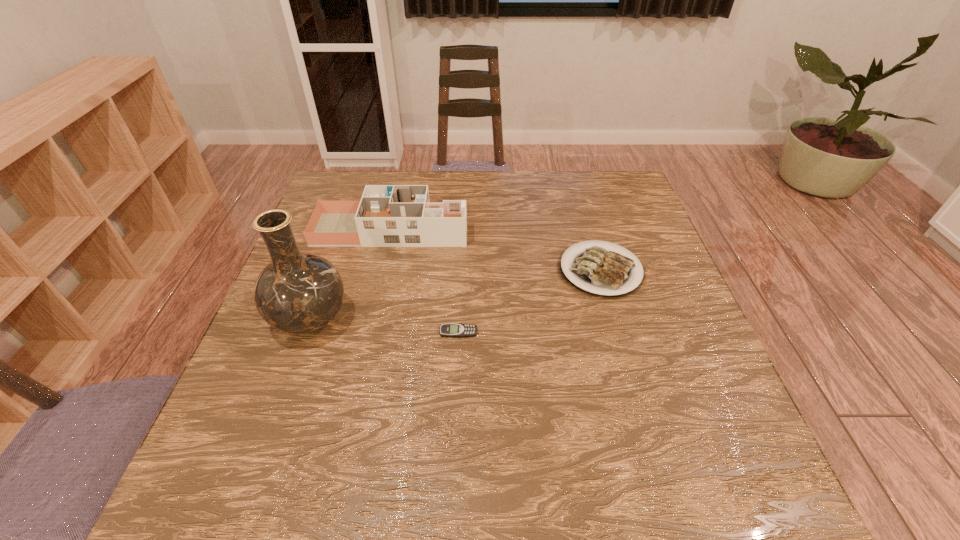
Point out which object is positioned as the third nearest to the tallest object. Please provide its 2D coordinates. Your answer should be formatted as a tuple, i.e. [(x, y)], where the tuple contains the x and y coordinates of a point satisfying the conditions above.

[(601, 271)]

You are a GUI agent. You are given a task and a screenshot of the screen. Output one action in this format:
    pyautogui.click(x=<x>, y=<y>)
    Task: Click on the object that is the closest to the dollhouse
    The width and height of the screenshot is (960, 540).
    Given the screenshot: What is the action you would take?
    pyautogui.click(x=297, y=293)

You are a GUI agent. You are given a task and a screenshot of the screen. Output one action in this format:
    pyautogui.click(x=<x>, y=<y>)
    Task: Click on the vacant region that satisfies the following two spatial constraints: 1. at the front door of the rightmost object; 2. on the right side of the third shortest object
    
    Given the screenshot: What is the action you would take?
    pyautogui.click(x=382, y=270)

Image resolution: width=960 pixels, height=540 pixels. I want to click on vacant region that satisfies the following two spatial constraints: 1. on the back side of the third tallest object; 2. at the front door of the third shortest object, so click(589, 229).

Identify the location of vacant point that satisfies the following two spatial constraints: 1. at the front door of the dollhouse; 2. on the front side of the vase. (371, 319).

Where is `free space that satisfies the following two spatial constraints: 1. on the back side of the plate; 2. on the left side of the tallest object`? The height and width of the screenshot is (540, 960). free space that satisfies the following two spatial constraints: 1. on the back side of the plate; 2. on the left side of the tallest object is located at coordinates (328, 270).

Locate an element on the screen. vacant space that satisfies the following two spatial constraints: 1. at the front door of the dollhouse; 2. on the front side of the vase is located at coordinates (371, 319).

Where is `vacant space that satisfies the following two spatial constraints: 1. at the front door of the dollhouse; 2. on the back side of the beeper`? The height and width of the screenshot is (540, 960). vacant space that satisfies the following two spatial constraints: 1. at the front door of the dollhouse; 2. on the back side of the beeper is located at coordinates (367, 332).